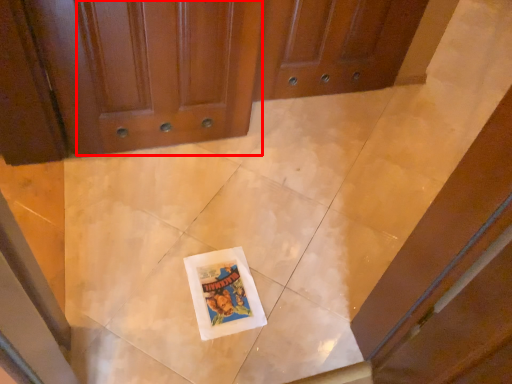
Question: Observing the image, what is the correct spatial positioning of door (annotated by the red box) in reference to comic book?

Choices:
 (A) right
 (B) left

Answer: (B)